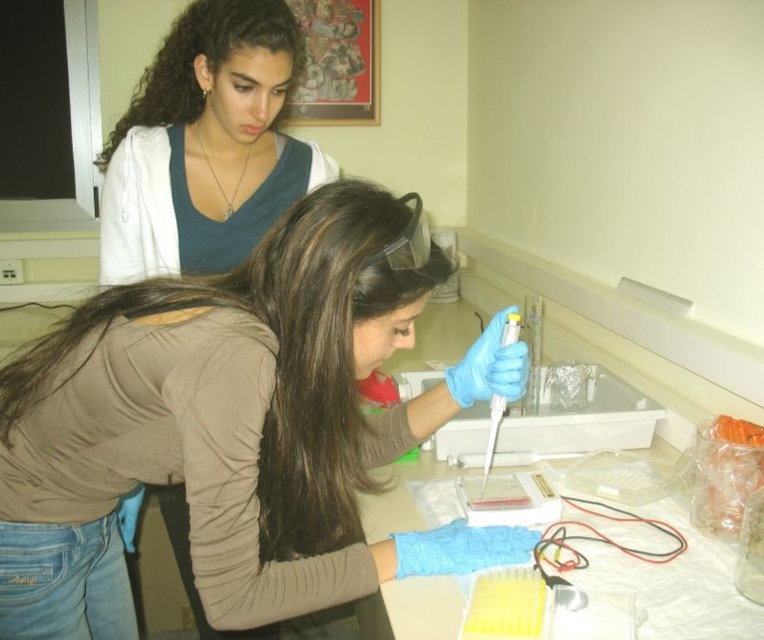
Is blue rubber glove at center to the left of matte blue shirt at upper left from the viewer's perspective?

No, blue rubber glove at center is not to the left of matte blue shirt at upper left.

Who is more forward, (186,358) or (267,64)?

Point (186,358) is more forward.

I want to click on blue rubber glove at center, so click(235, 426).

Is blue rubber glove at center thinner than white plastic pipette at center?

Incorrect, blue rubber glove at center's width is not less than white plastic pipette at center's.

The width and height of the screenshot is (764, 640). I want to click on blue rubber glove at center, so click(x=235, y=426).

Between point (21, 634) and point (513, 333), which one is positioned in front?

Point (21, 634) is in front.

Image resolution: width=764 pixels, height=640 pixels. What are the coordinates of `blue rubber glove at center` in the screenshot? It's located at (235, 426).

Is point (225, 252) behind point (491, 456)?

Yes.

Does point (185, 225) come closer to viewer compared to point (487, 472)?

No, (185, 225) is further to viewer.

This screenshot has height=640, width=764. What are the coordinates of `matte blue shirt at upper left` in the screenshot? It's located at (206, 145).